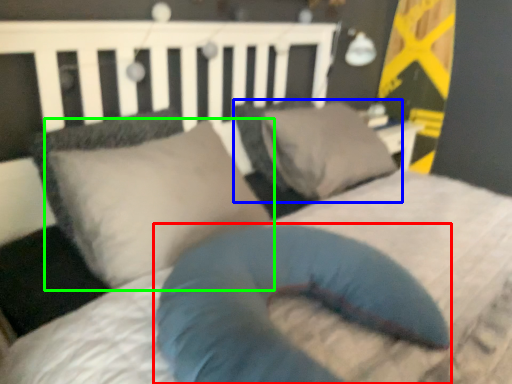
Question: Estimate the real-world distances between objects in this image. Which object is farther from pillow (highlighted by a red box), pillow (highlighted by a blue box) or pillow (highlighted by a green box)?

Choices:
 (A) pillow
 (B) pillow

Answer: (A)